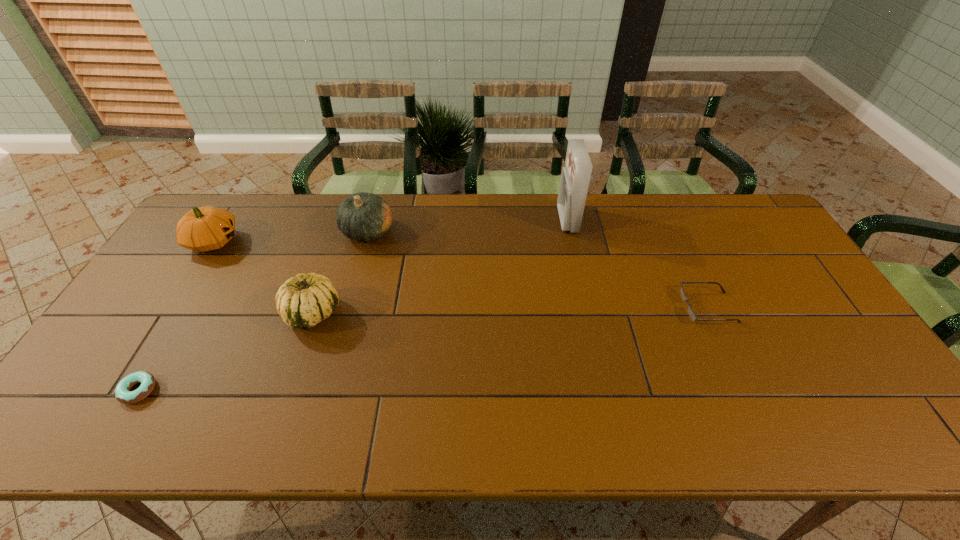
Where is `empty space between the nearest object and the tallest object`? Image resolution: width=960 pixels, height=540 pixels. empty space between the nearest object and the tallest object is located at coordinates (353, 305).

Locate an element on the screen. The height and width of the screenshot is (540, 960). vacant space in between the tallest object and the nearest gourd is located at coordinates (440, 266).

The image size is (960, 540). I want to click on vacant space in between the nearest gourd and the fifth tallest object, so click(511, 310).

Where is `object that is the nearest to the second object from right to left`? object that is the nearest to the second object from right to left is located at coordinates (684, 298).

Locate which object is the closest to the doughnut. Please provide its 2D coordinates. Your answer should be formatted as a tuple, i.e. [(x, y)], where the tuple contains the x and y coordinates of a point satisfying the conditions above.

[(302, 301)]

Identify which gourd is located as the second nearest to the leftmost gourd. Please provide its 2D coordinates. Your answer should be formatted as a tuple, i.e. [(x, y)], where the tuple contains the x and y coordinates of a point satisfying the conditions above.

[(363, 216)]

Select which gourd appears as the third closest to the shortest object. Please provide its 2D coordinates. Your answer should be formatted as a tuple, i.e. [(x, y)], where the tuple contains the x and y coordinates of a point satisfying the conditions above.

[(363, 216)]

Identify the location of vacant area in the image that satisfies the following two spatial constraints: 1. on the side of the leftmost gourd with the carved face; 2. on the back side of the nearest object. The height and width of the screenshot is (540, 960). (120, 390).

At what (x,y) coordinates should I click in order to perform the action: click on free space that satisfies the following two spatial constraints: 1. on the side of the leftmost gourd with the carved face; 2. on the back side of the doughnut. Please return your answer as a coordinate pair (x, y). Image resolution: width=960 pixels, height=540 pixels. Looking at the image, I should click on (120, 390).

Locate an element on the screen. free space that satisfies the following two spatial constraints: 1. on the front-facing side of the second shortest object; 2. on the front side of the nearest gourd is located at coordinates (710, 313).